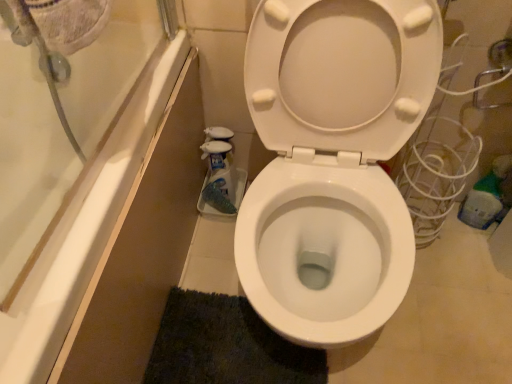
Question: Is there a large distance between white glossy toilet at center and dark blue textured bath mat at lower center?

Choices:
 (A) yes
 (B) no

Answer: (B)

Question: Does white glossy toilet at center have a lesser width compared to dark blue textured bath mat at lower center?

Choices:
 (A) no
 (B) yes

Answer: (A)

Question: From a real-world perspective, is white glossy toilet at center below dark blue textured bath mat at lower center?

Choices:
 (A) no
 (B) yes

Answer: (A)

Question: Is white glossy toilet at center wider than dark blue textured bath mat at lower center?

Choices:
 (A) no
 (B) yes

Answer: (B)

Question: From the image's perspective, would you say white glossy toilet at center is positioned over dark blue textured bath mat at lower center?

Choices:
 (A) no
 (B) yes

Answer: (B)

Question: Is white glossy toilet at center next to dark blue textured bath mat at lower center?

Choices:
 (A) yes
 (B) no

Answer: (B)

Question: Would you say dark blue textured bath mat at lower center is outside white glossy toilet at center?

Choices:
 (A) no
 (B) yes

Answer: (A)

Question: Considering the relative sizes of dark blue textured bath mat at lower center and white glossy toilet at center in the image provided, is dark blue textured bath mat at lower center bigger than white glossy toilet at center?

Choices:
 (A) no
 (B) yes

Answer: (A)

Question: Is dark blue textured bath mat at lower center oriented away from white glossy toilet at center?

Choices:
 (A) no
 (B) yes

Answer: (B)

Question: Is there a large distance between dark blue textured bath mat at lower center and white glossy toilet at center?

Choices:
 (A) no
 (B) yes

Answer: (A)

Question: From a real-world perspective, is dark blue textured bath mat at lower center physically above white glossy toilet at center?

Choices:
 (A) yes
 (B) no

Answer: (B)

Question: Considering the relative sizes of dark blue textured bath mat at lower center and white glossy toilet at center in the image provided, is dark blue textured bath mat at lower center shorter than white glossy toilet at center?

Choices:
 (A) yes
 (B) no

Answer: (A)

Question: Do you think dark blue textured bath mat at lower center is within white glossy toilet at center, or outside of it?

Choices:
 (A) inside
 (B) outside

Answer: (A)